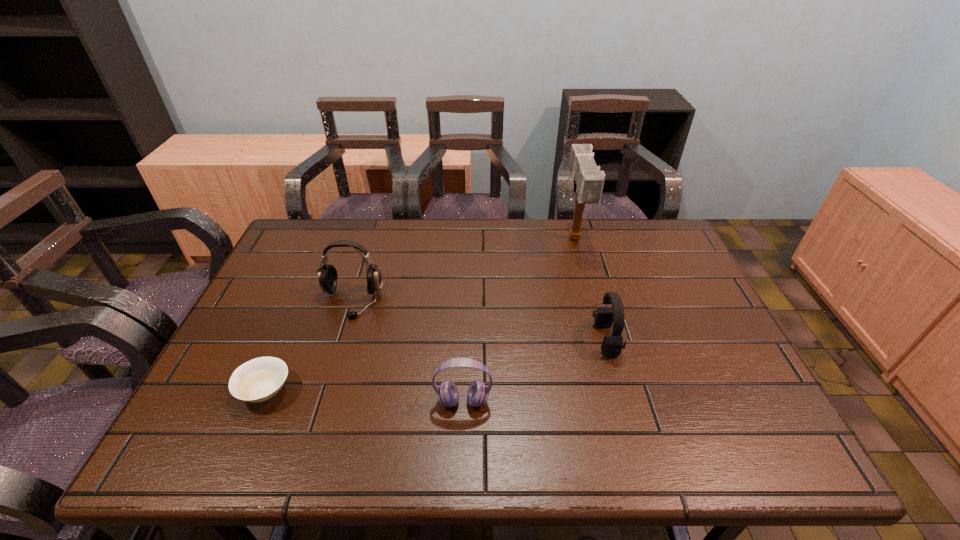
What are the coordinates of `vacant area that lies between the tallest headset and the third object from left to right` in the screenshot? It's located at (407, 352).

You are a GUI agent. You are given a task and a screenshot of the screen. Output one action in this format:
    pyautogui.click(x=<x>, y=<y>)
    Task: Click on the vacant area between the mallet and the shortest object
    
    Given the screenshot: What is the action you would take?
    pyautogui.click(x=420, y=314)

The height and width of the screenshot is (540, 960). What are the coordinates of `free space between the nearest headset and the tallest object` in the screenshot? It's located at [x=518, y=320].

Find the location of `vacant space that is in between the leftmost headset and the third object from right to left`. vacant space that is in between the leftmost headset and the third object from right to left is located at coordinates (407, 352).

Identify the location of vacant area that lies between the bowl and the tallest headset. (308, 346).

Find the location of a particular element. object that stands as the third closest to the mallet is located at coordinates (327, 275).

Locate an element on the screen. This screenshot has height=540, width=960. object that is the closest one to the second headset from right to left is located at coordinates [327, 275].

Choose which headset is the second nearest neighbor to the rightmost headset. Please provide its 2D coordinates. Your answer should be formatted as a tuple, i.e. [(x, y)], where the tuple contains the x and y coordinates of a point satisfying the conditions above.

[(327, 275)]

Select which headset appears as the closest to the bowl. Please provide its 2D coordinates. Your answer should be formatted as a tuple, i.e. [(x, y)], where the tuple contains the x and y coordinates of a point satisfying the conditions above.

[(327, 275)]

I want to click on vacant region that satisfies the following two spatial constraints: 1. on the headband of the third farthest object; 2. on the front side of the shortest object, so click(x=620, y=390).